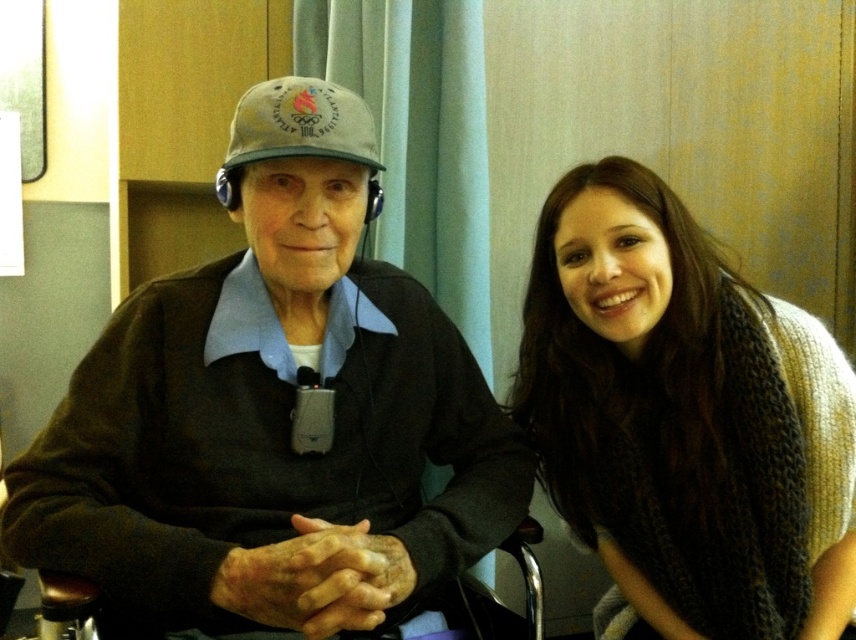
You are an interior designer planning to hang a picture frame between the matte gray cap at center and the knitted scarf at right. Since the picture frame is 30 cm tall, can you fit it vertically between them?

The matte gray cap at center is located above the knitted scarf at right, but the vertical distance between them isn not specified in the objects description. Therefore, it is uncertain if the 30 cm tall picture frame can fit vertically between them.

You are a photographer setting up a portrait in this scene. You need to ensure that both the matte gray cap at center and the knitted scarf at right are clearly visible in the frame. Based on their sizes, which object might require you to adjust your camera angle to avoid being blocked by other elements?

The matte gray cap at center is not as tall as the knitted scarf at right, so the shorter matte gray cap at center might be more likely to be blocked by other elements and require adjustment to ensure visibility.